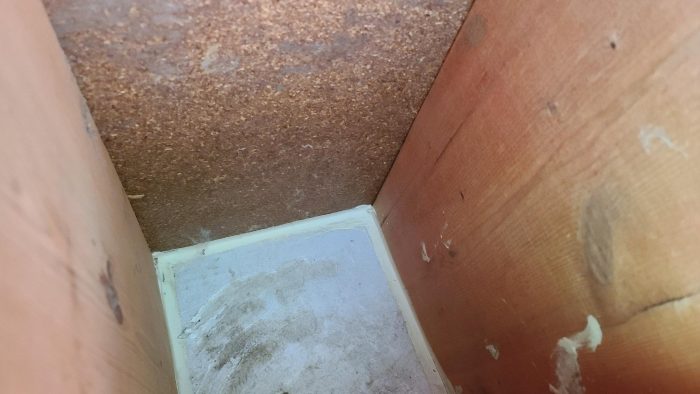
Locate an element on the screen. The width and height of the screenshot is (700, 394). blurry left side of wood panel is located at coordinates [x=77, y=192].